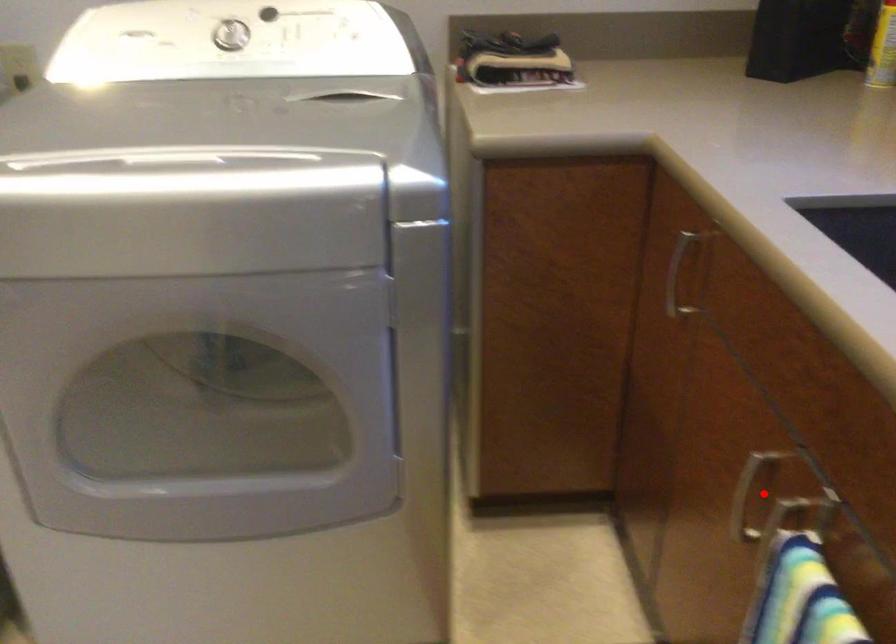
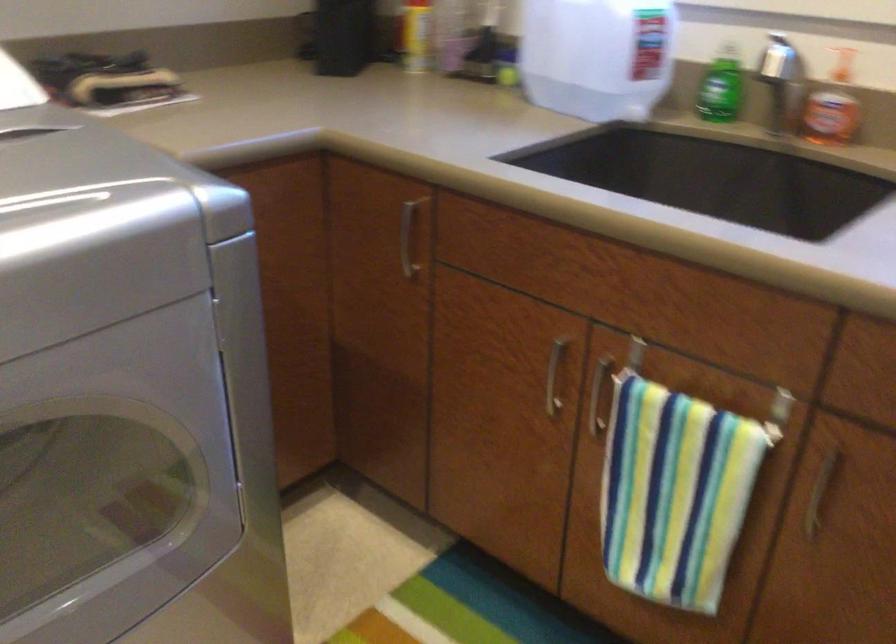
Find the pixel in the second image that matches the highlighted location in the first image.

(554, 375)